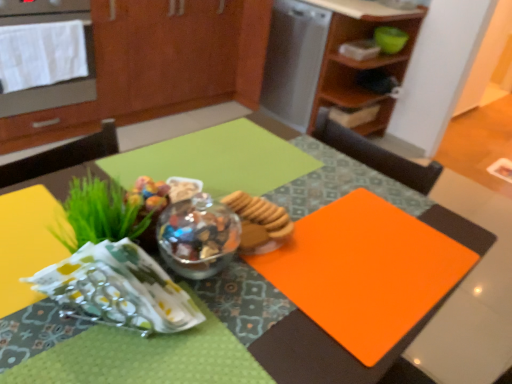
Question: Is teal bowl at upper right taller or shorter than wooden cabinet at upper right, the first cabinetry in the right-to-left sequence?

Choices:
 (A) short
 (B) tall

Answer: (A)

Question: Choose the correct answer: Is teal bowl at upper right inside wooden cabinet at upper right, the first cabinetry in the right-to-left sequence, or outside it?

Choices:
 (A) inside
 (B) outside

Answer: (A)

Question: Estimate the real-world distances between objects in this image. Which object is farther from the brushed metal oven at upper left?

Choices:
 (A) satin silver dishwasher at upper center
 (B) wooden cabinet at upper right, the first cabinetry in the right-to-left sequence
 (C) orange matte placemat at center
 (D) teal bowl at upper right
 (E) matte wood cabinetry at upper center, which is the 2th cabinetry in right-to-left order

Answer: (C)

Question: Which object is the farthest from the satin silver dishwasher at upper center?

Choices:
 (A) orange matte placemat at center
 (B) wooden cabinet at upper right, the first cabinetry in the right-to-left sequence
 (C) teal bowl at upper right
 (D) matte wood cabinetry at upper center, the first cabinetry viewed from the left
 (E) brushed metal oven at upper left

Answer: (A)